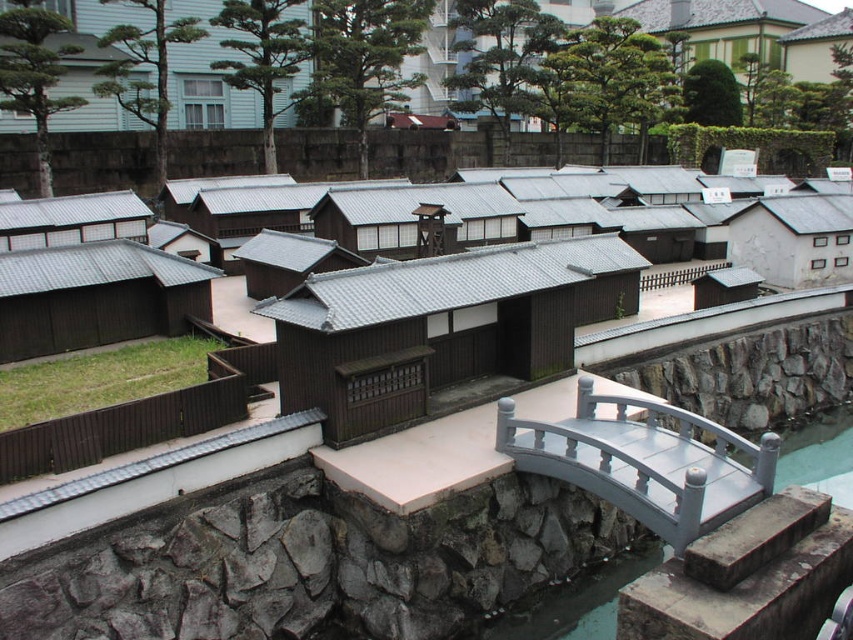
Question: Does matte brown wooden hut at center have a larger size compared to matte gray roof at left?

Choices:
 (A) no
 (B) yes

Answer: (B)

Question: Is matte brown wooden hut at center positioned in front of smooth gray bridge at lower center?

Choices:
 (A) yes
 (B) no

Answer: (B)

Question: Which point is farther to the camera?

Choices:
 (A) white matte building at right
 (B) matte gray roof at left
 (C) matte brown wooden hut at center
 (D) brown wood hut at lower left

Answer: (A)

Question: Which of the following is the farthest from the observer?

Choices:
 (A) white matte building at right
 (B) matte brown wooden hut at center
 (C) brown wood hut at lower left
 (D) matte gray roof at left

Answer: (A)

Question: Based on their relative distances, which object is nearer to the brown wood hut at lower left?

Choices:
 (A) white matte building at right
 (B) matte brown wooden hut at center
 (C) matte gray roof at left

Answer: (C)

Question: Does brown wood hut at lower left appear over matte gray roof at left?

Choices:
 (A) yes
 (B) no

Answer: (B)